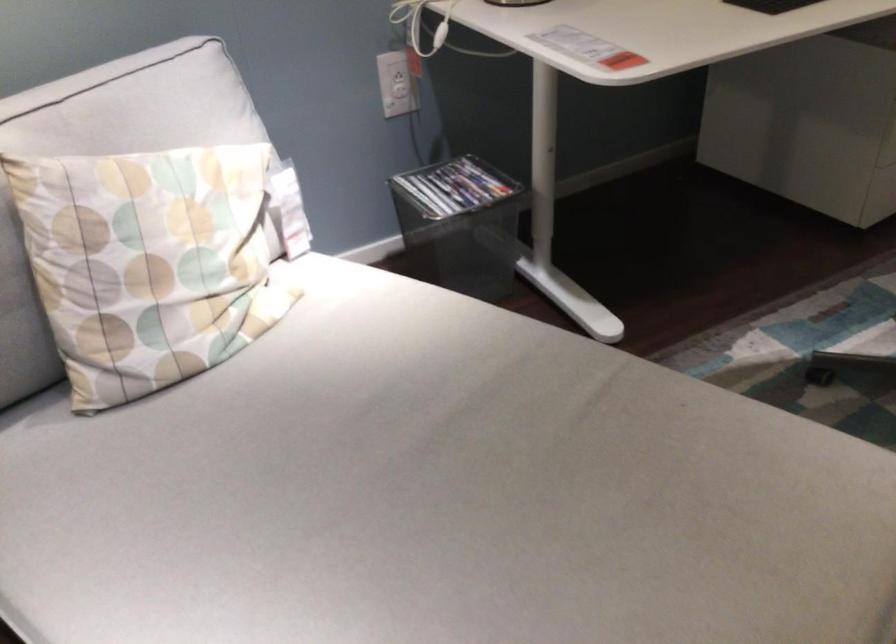
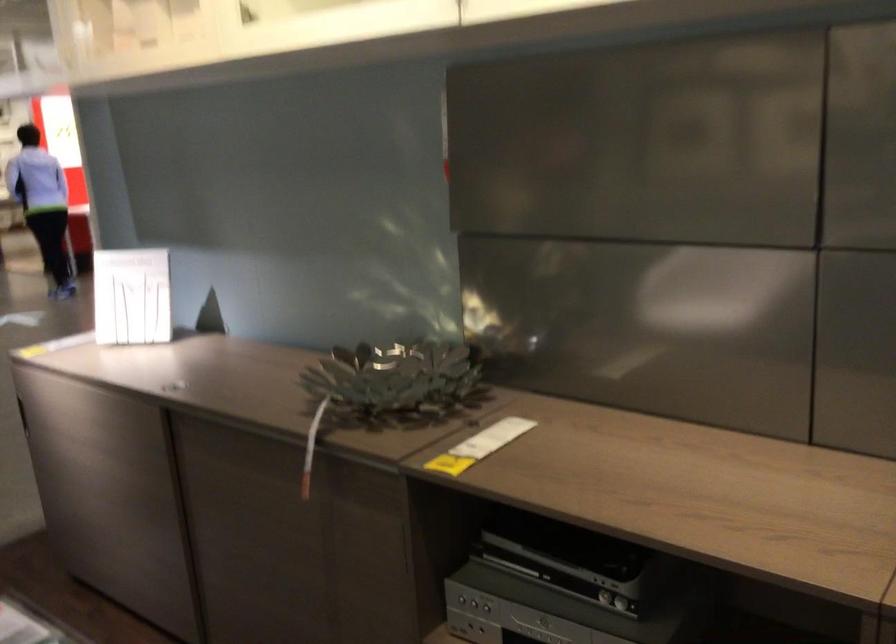
How did the camera likely rotate?

The camera rotated toward right-down.